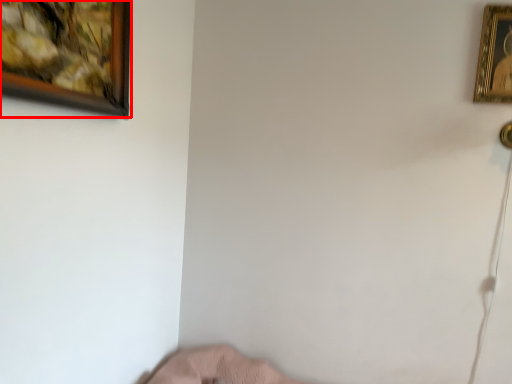
Question: From the image's perspective, what is the correct spatial positioning of picture frame (annotated by the red box) in reference to picture frame?

Choices:
 (A) above
 (B) below

Answer: (B)